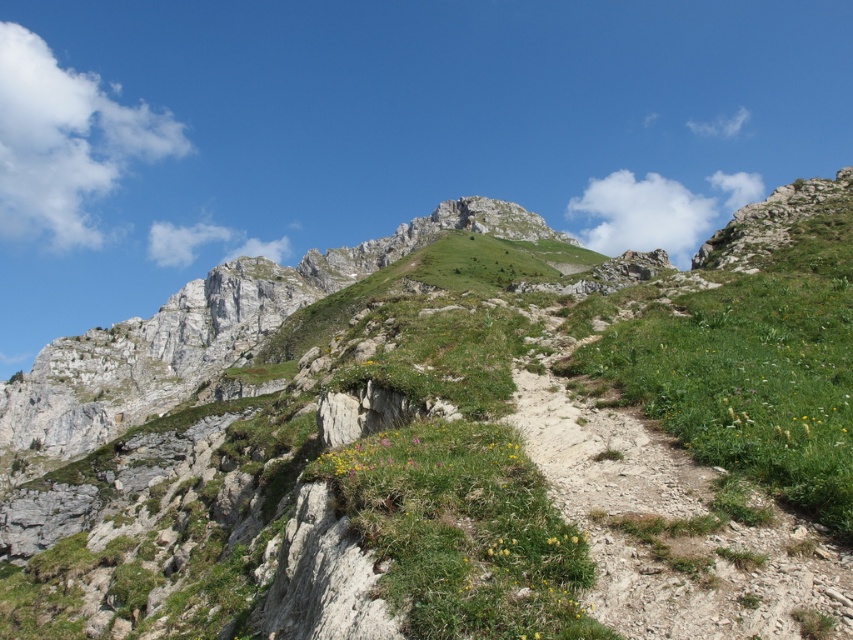
Question: Can you confirm if green grassy mountain at upper center is positioned below dusty gravel trail at center-right?

Choices:
 (A) no
 (B) yes

Answer: (A)

Question: Which point is closer to the camera taking this photo?

Choices:
 (A) (270, 372)
 (B) (659, 572)

Answer: (B)

Question: Does green grassy mountain at upper center have a greater width compared to dusty gravel trail at center-right?

Choices:
 (A) yes
 (B) no

Answer: (A)

Question: Is green grassy mountain at upper center behind dusty gravel trail at center-right?

Choices:
 (A) no
 (B) yes

Answer: (B)